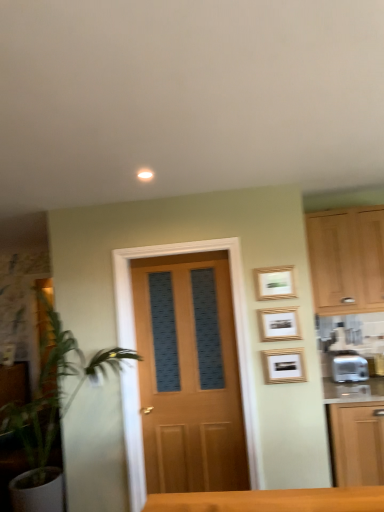
Image resolution: width=384 pixels, height=512 pixels. Find the location of `gold-framed picture at center-right, which appears as the 3th picture frame when viewed from the top`. gold-framed picture at center-right, which appears as the 3th picture frame when viewed from the top is located at coordinates (284, 365).

Locate an element on the screen. This screenshot has height=512, width=384. light wood cabinet at right, the first cabinetry from the right is located at coordinates (347, 260).

The width and height of the screenshot is (384, 512). What do you see at coordinates (189, 376) in the screenshot? I see `wooden door at center` at bounding box center [189, 376].

What do you see at coordinates (14, 383) in the screenshot? The image size is (384, 512). I see `matte wood cabinet at left, which is the 1th cabinetry in left-to-right order` at bounding box center [14, 383].

The width and height of the screenshot is (384, 512). What do you see at coordinates (349, 367) in the screenshot? I see `silver metallic toaster at right` at bounding box center [349, 367].

Describe the element at coordinates (55, 390) in the screenshot. Image resolution: width=384 pixels, height=512 pixels. I see `green leafy plant at left` at that location.

The image size is (384, 512). What do you see at coordinates (275, 283) in the screenshot? I see `gold-framed picture at upper right, the first picture frame from the top` at bounding box center [275, 283].

You are a GUI agent. You are given a task and a screenshot of the screen. Output one action in this format:
    pyautogui.click(x=<x>, y=<y>)
    Task: Click on the gold-framed picture at center-right, which appears as the 3th picture frame when viewed from the top
    This screenshot has width=384, height=512.
    Given the screenshot: What is the action you would take?
    pyautogui.click(x=284, y=365)

Who is smaller, wooden door at center or silver metallic toaster at right?

With smaller size is silver metallic toaster at right.

Is silver metallic toaster at right surrounded by wooden door at center?

Actually, silver metallic toaster at right is outside wooden door at center.

Is wooden door at center oriented towards silver metallic toaster at right?

No, wooden door at center is not oriented towards silver metallic toaster at right.

Locate an element on the screen. The width and height of the screenshot is (384, 512). houseplant in front of the silver metallic toaster at right is located at coordinates (55, 390).

Does point (63, 362) come in front of point (347, 352)?

Yes.

Are green leafy plant at left and silver metallic toaster at right far apart?

green leafy plant at left is positioned a significant distance from silver metallic toaster at right.

Which picture frame is the 2nd one when counting from the back of the green leafy plant at left? Please provide its 2D coordinates.

[(279, 324)]

Can we say gold-framed picture at upper right, arranged as the second picture frame when ordered from the bottom, lies outside green leafy plant at left?

Yes, gold-framed picture at upper right, arranged as the second picture frame when ordered from the bottom, is not within green leafy plant at left.

Is gold-framed picture at upper right, which ranks as the 2th picture frame in top-to-bottom order, oriented towards green leafy plant at left?

No, gold-framed picture at upper right, which ranks as the 2th picture frame in top-to-bottom order, is not turned towards green leafy plant at left.

Can you confirm if gold-framed picture at center-right, which appears as the 3th picture frame when viewed from the top, is wider than gold-framed picture at upper right, which is counted as the 3th picture frame, starting from the bottom?

No, gold-framed picture at center-right, which appears as the 3th picture frame when viewed from the top, is not wider than gold-framed picture at upper right, which is counted as the 3th picture frame, starting from the bottom.

Considering the relative positions of gold-framed picture at center-right, which appears as the 3th picture frame when viewed from the top, and gold-framed picture at upper right, the first picture frame from the top, in the image provided, is gold-framed picture at center-right, which appears as the 3th picture frame when viewed from the top, in front of gold-framed picture at upper right, the first picture frame from the top,?

Yes, gold-framed picture at center-right, which appears as the 3th picture frame when viewed from the top, is closer to the viewer.

Who is bigger, gold-framed picture at center-right, which appears as the 3th picture frame when viewed from the top, or gold-framed picture at upper right, which is counted as the 3th picture frame, starting from the bottom?

gold-framed picture at upper right, which is counted as the 3th picture frame, starting from the bottom.

Which is closer, [264,366] or [276,298]?

The point [264,366] is closer to the camera.

From a real-world perspective, count 1st picture frames downward from the gold-framed picture at upper right, the first picture frame from the top, and point to it. Please provide its 2D coordinates.

[(279, 324)]

Considering the relative sizes of gold-framed picture at upper right, arranged as the second picture frame when ordered from the bottom, and gold-framed picture at upper right, the first picture frame from the top, in the image provided, is gold-framed picture at upper right, arranged as the second picture frame when ordered from the bottom, shorter than gold-framed picture at upper right, the first picture frame from the top,?

No, gold-framed picture at upper right, arranged as the second picture frame when ordered from the bottom, is not shorter than gold-framed picture at upper right, the first picture frame from the top.

Considering the relative sizes of gold-framed picture at upper right, arranged as the second picture frame when ordered from the bottom, and gold-framed picture at upper right, the first picture frame from the top, in the image provided, is gold-framed picture at upper right, arranged as the second picture frame when ordered from the bottom, smaller than gold-framed picture at upper right, the first picture frame from the top,?

No, gold-framed picture at upper right, arranged as the second picture frame when ordered from the bottom, is not smaller than gold-framed picture at upper right, the first picture frame from the top.

Who is shorter, light wood cabinet at right, which ranks as the second cabinetry in left-to-right order, or silver metallic toaster at right?

silver metallic toaster at right is shorter.

Is light wood cabinet at right, which ranks as the second cabinetry in left-to-right order, smaller than silver metallic toaster at right?

No.

Considering the positions of objects light wood cabinet at right, acting as the first cabinetry starting from the front, and silver metallic toaster at right in the image provided, who is in front, light wood cabinet at right, acting as the first cabinetry starting from the front, or silver metallic toaster at right?

light wood cabinet at right, acting as the first cabinetry starting from the front, is closer to the camera.

Which object is positioned more to the left, light wood cabinet at right, which ranks as the second cabinetry in left-to-right order, or silver metallic toaster at right?

From the viewer's perspective, silver metallic toaster at right appears more on the left side.

Does silver metallic toaster at right have a lesser height compared to gold-framed picture at center-right, which appears as the 3th picture frame when viewed from the top?

In fact, silver metallic toaster at right may be taller than gold-framed picture at center-right, which appears as the 3th picture frame when viewed from the top.

Can you confirm if silver metallic toaster at right is positioned to the right of gold-framed picture at center-right, the 1th picture frame from the bottom?

Yes, silver metallic toaster at right is to the right of gold-framed picture at center-right, the 1th picture frame from the bottom.

Could gold-framed picture at center-right, the 1th picture frame from the bottom, be considered to be inside silver metallic toaster at right?

Actually, gold-framed picture at center-right, the 1th picture frame from the bottom, is outside silver metallic toaster at right.

How different are the orientations of silver metallic toaster at right and gold-framed picture at center-right, which appears as the 3th picture frame when viewed from the top, in degrees?

silver metallic toaster at right and gold-framed picture at center-right, which appears as the 3th picture frame when viewed from the top, are facing 2.82 degrees away from each other.

The image size is (384, 512). Identify the location of appliance located behind the wooden door at center. (349, 367).

Find the location of `houseplant that appears on the left of silver metallic toaster at right`. houseplant that appears on the left of silver metallic toaster at right is located at coordinates (55, 390).

Considering their positions, is silver metallic toaster at right positioned further to light wood cabinet at right, positioned as the second cabinetry in back-to-front order, than green leafy plant at left?

Based on the image, green leafy plant at left appears to be further to light wood cabinet at right, positioned as the second cabinetry in back-to-front order.

Considering their positions, is light wood cabinet at right, acting as the first cabinetry starting from the front, positioned further to gold-framed picture at upper right, which ranks as the 2th picture frame in top-to-bottom order, than wooden door at center?

Based on the image, light wood cabinet at right, acting as the first cabinetry starting from the front, appears to be further to gold-framed picture at upper right, which ranks as the 2th picture frame in top-to-bottom order.

In the scene shown: Which object lies nearer to the anchor point gold-framed picture at upper right, which is counted as the 3th picture frame, starting from the bottom, gold-framed picture at center-right, the 1th picture frame from the bottom, or wooden door at center?

Based on the image, gold-framed picture at center-right, the 1th picture frame from the bottom, appears to be nearer to gold-framed picture at upper right, which is counted as the 3th picture frame, starting from the bottom.

Which object lies further to the anchor point silver metallic toaster at right, gold-framed picture at upper right, which ranks as the 2th picture frame in top-to-bottom order, or gold-framed picture at upper right, which is counted as the 3th picture frame, starting from the bottom?

The object further to silver metallic toaster at right is gold-framed picture at upper right, which is counted as the 3th picture frame, starting from the bottom.

Based on their spatial positions, is gold-framed picture at upper right, the first picture frame from the top, or light wood cabinet at right, placed as the second cabinetry when sorted from bottom to top, closer to wooden door at center?

gold-framed picture at upper right, the first picture frame from the top, is closer to wooden door at center.

Which object lies further to the anchor point green leafy plant at left, matte wood cabinet at left, which is the 1th cabinetry in left-to-right order, or light wood cabinet at right, the 1th cabinetry viewed from the top?

light wood cabinet at right, the 1th cabinetry viewed from the top, lies further to green leafy plant at left than the other object.

From the image, which object appears to be farther from green leafy plant at left, gold-framed picture at upper right, which ranks as the 2th picture frame in top-to-bottom order, or gold-framed picture at center-right, which appears as the 3th picture frame when viewed from the top?

gold-framed picture at upper right, which ranks as the 2th picture frame in top-to-bottom order, lies further to green leafy plant at left than the other object.

Considering their positions, is gold-framed picture at upper right, the first picture frame from the top, positioned further to light wood cabinet at right, positioned as the second cabinetry in back-to-front order, than gold-framed picture at center-right, the 1th picture frame from the bottom?

gold-framed picture at center-right, the 1th picture frame from the bottom.

Where is `door between matte wood cabinet at left, which is the 2th cabinetry from right to left, and light wood cabinet at right, positioned as the second cabinetry in back-to-front order`? The image size is (384, 512). door between matte wood cabinet at left, which is the 2th cabinetry from right to left, and light wood cabinet at right, positioned as the second cabinetry in back-to-front order is located at coordinates (189, 376).

At what (x,y) coordinates should I click in order to perform the action: click on door located between matte wood cabinet at left, the first cabinetry ordered from the bottom, and gold-framed picture at upper right, which is counted as the 3th picture frame, starting from the bottom, in the left-right direction. Please return your answer as a coordinate pair (x, y). The height and width of the screenshot is (512, 384). Looking at the image, I should click on (189, 376).

Identify the location of picture frame situated between matte wood cabinet at left, the first cabinetry ordered from the bottom, and gold-framed picture at upper right, arranged as the second picture frame when ordered from the bottom, from left to right. (275, 283).

What are the coordinates of `houseplant between matte wood cabinet at left, the 2th cabinetry from the top, and light wood cabinet at right, the 1th cabinetry viewed from the top, in the horizontal direction` in the screenshot? It's located at (55, 390).